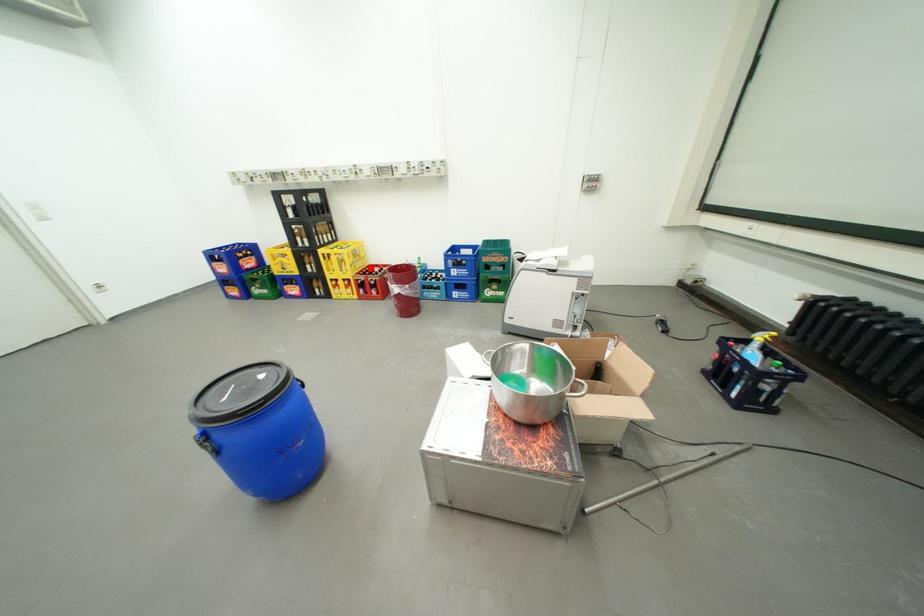
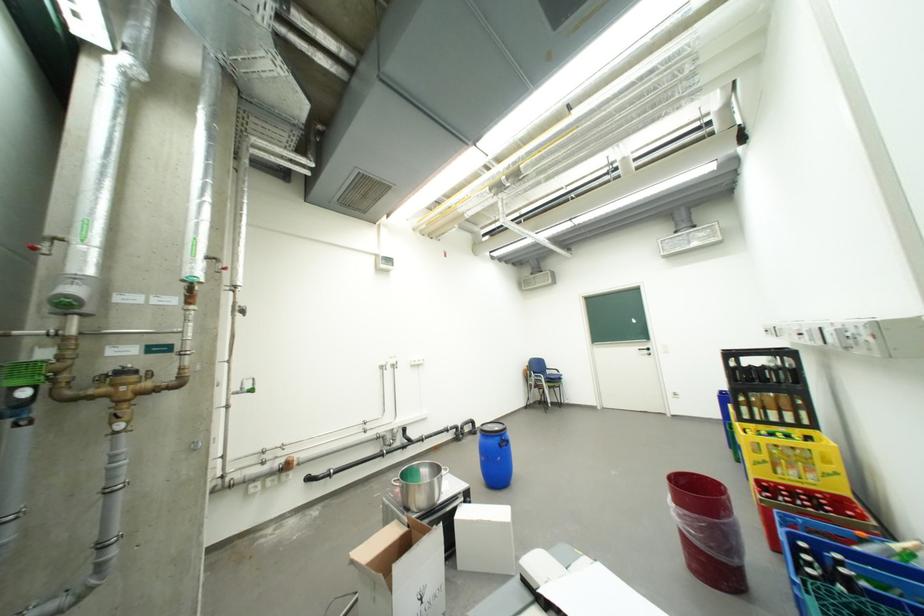
The point at the highlighted location is marked in the first image. Where is the corresponding point in the second image?

(810, 484)